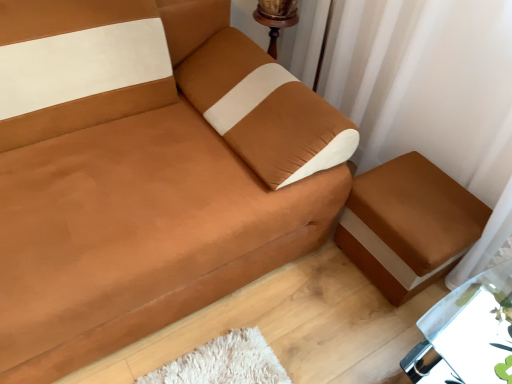
Question: In terms of width, does white sheer curtain at upper right look wider or thinner when compared to metallic silver table at lower right?

Choices:
 (A) wide
 (B) thin

Answer: (B)

Question: From a real-world perspective, is white sheer curtain at upper right physically located above or below metallic silver table at lower right?

Choices:
 (A) below
 (B) above

Answer: (B)

Question: Which is nearer to the suede-like brown couch at center?

Choices:
 (A) brown fabric ottoman at lower right
 (B) metallic silver table at lower right
 (C) white sheer curtain at upper right

Answer: (A)

Question: Estimate the real-world distances between objects in this image. Which object is farther from the brown fabric ottoman at lower right?

Choices:
 (A) white sheer curtain at upper right
 (B) metallic silver table at lower right
 (C) suede-like brown couch at center

Answer: (C)